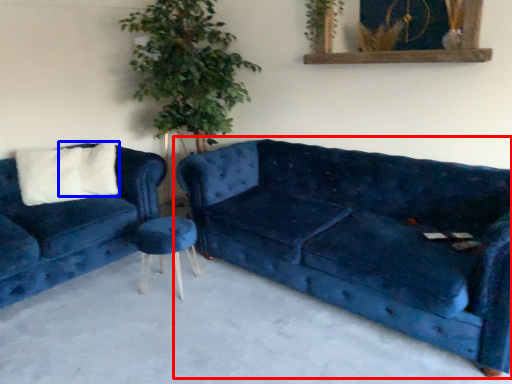
Question: Which object appears closest to the camera in this image, studio couch (highlighted by a red box) or pillow (highlighted by a blue box)?

Choices:
 (A) studio couch
 (B) pillow

Answer: (A)